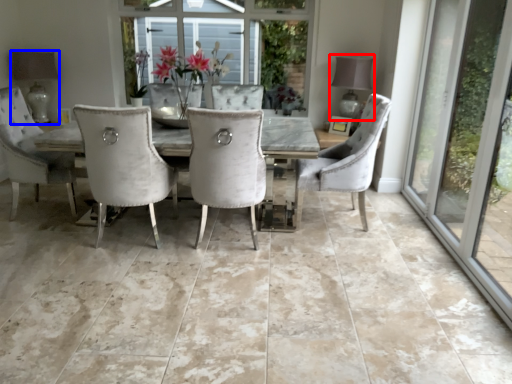
Question: Which object is closer to the camera taking this photo, lamp (highlighted by a red box) or lamp (highlighted by a blue box)?

Choices:
 (A) lamp
 (B) lamp

Answer: (A)